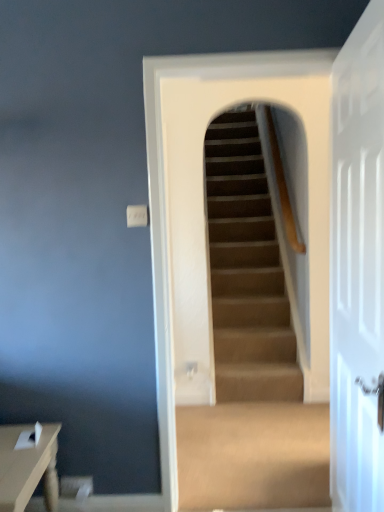
I want to click on matte brown table at lower left, so click(27, 467).

In order to face carpeted stairs at center, should I rotate leftwards or rightwards?

To face it directly, rotate right by 8.683 degrees.

You are a GUI agent. You are given a task and a screenshot of the screen. Output one action in this format:
    pyautogui.click(x=<x>, y=<y>)
    Task: Click on the matte brown table at lower left
    This screenshot has height=512, width=384.
    Given the screenshot: What is the action you would take?
    pyautogui.click(x=27, y=467)

Based on the photo, is carpeted stairs at center completely or partially inside white glossy door at right?

No, carpeted stairs at center is not a part of white glossy door at right.

From the image's perspective, is white glossy door at right located above or below carpeted stairs at center?

white glossy door at right is situated lower than carpeted stairs at center in the image.

Between white glossy door at right and carpeted stairs at center, which one has larger size?

With larger size is carpeted stairs at center.

Is white glossy door at right thinner than carpeted stairs at center?

Yes, white glossy door at right is thinner than carpeted stairs at center.

From a real-world perspective, is carpeted stairs at center above or below white glossy door at right?

From a real-world perspective, carpeted stairs at center is physically above white glossy door at right.

Is point (262, 244) less distant than point (333, 252)?

No, (262, 244) is further to viewer.

Is carpeted stairs at center looking in the opposite direction of white glossy door at right?

No, carpeted stairs at center's orientation is not away from white glossy door at right.

Is carpeted stairs at center touching white glossy door at right?

No.

Based on their sizes in the image, would you say carpeted stairs at center is bigger or smaller than matte brown table at lower left?

carpeted stairs at center is bigger than matte brown table at lower left.

Considering the positions of objects carpeted stairs at center and matte brown table at lower left in the image provided, who is more to the right, carpeted stairs at center or matte brown table at lower left?

From the viewer's perspective, carpeted stairs at center appears more on the right side.

Looking at their sizes, would you say carpeted stairs at center is wider or thinner than matte brown table at lower left?

In the image, carpeted stairs at center appears to be more narrow than matte brown table at lower left.

Which is closer, (224, 450) or (10, 432)?

The point (10, 432) is closer to the camera.

In the scene shown: From the image's perspective, is matte brown table at lower left above or below white glossy door at right?

Clearly, from the image's perspective, matte brown table at lower left is below white glossy door at right.

Are matte brown table at lower left and white glossy door at right located far from each other?

Indeed, matte brown table at lower left is not near white glossy door at right.

Can you confirm if matte brown table at lower left is bigger than white glossy door at right?

No, matte brown table at lower left is not bigger than white glossy door at right.

Does matte brown table at lower left appear on the right side of white glossy door at right?

In fact, matte brown table at lower left is to the left of white glossy door at right.

Can you confirm if matte brown table at lower left is wider than carpeted stairs at center?

Correct, the width of matte brown table at lower left exceeds that of carpeted stairs at center.

Is matte brown table at lower left facing away from carpeted stairs at center?

matte brown table at lower left does not have its back to carpeted stairs at center.

Which is in front, point (52, 470) or point (225, 155)?

Positioned in front is point (52, 470).

Considering the sizes of objects matte brown table at lower left and carpeted stairs at center in the image provided, who is smaller, matte brown table at lower left or carpeted stairs at center?

With smaller size is matte brown table at lower left.

Does white glossy door at right have a greater width compared to matte brown table at lower left?

In fact, white glossy door at right might be narrower than matte brown table at lower left.

Considering the positions of objects white glossy door at right and matte brown table at lower left in the image provided, who is behind, white glossy door at right or matte brown table at lower left?

matte brown table at lower left is behind.

Does white glossy door at right have a lesser height compared to matte brown table at lower left?

No, white glossy door at right is not shorter than matte brown table at lower left.

Can you confirm if white glossy door at right is bigger than matte brown table at lower left?

Indeed, white glossy door at right has a larger size compared to matte brown table at lower left.

There is a white glossy door at right. Where is `escalator above it (from a real-world perspective)`? This screenshot has width=384, height=512. escalator above it (from a real-world perspective) is located at coordinates (249, 352).

Image resolution: width=384 pixels, height=512 pixels. In order to click on door directly beneath the carpeted stairs at center (from a real-world perspective) in this screenshot , I will do `click(358, 268)`.

Based on the photo, from the image, which object appears to be nearer to carpeted stairs at center, matte brown table at lower left or white glossy door at right?

matte brown table at lower left.

Considering their positions, is carpeted stairs at center positioned further to matte brown table at lower left than white glossy door at right?

carpeted stairs at center is positioned further to the anchor matte brown table at lower left.

When comparing their distances from carpeted stairs at center, does white glossy door at right or matte brown table at lower left seem further?

white glossy door at right.

From the image, which object appears to be farther from white glossy door at right, matte brown table at lower left or carpeted stairs at center?

Among the two, carpeted stairs at center is located further to white glossy door at right.

In the scene shown: Considering their positions, is carpeted stairs at center positioned further to white glossy door at right than matte brown table at lower left?

carpeted stairs at center is positioned further to the anchor white glossy door at right.

Based on their spatial positions, is white glossy door at right or carpeted stairs at center closer to matte brown table at lower left?

Among the two, white glossy door at right is located nearer to matte brown table at lower left.

At what (x,y) coordinates should I click in order to perform the action: click on escalator located between matte brown table at lower left and white glossy door at right in the left-right direction. Please return your answer as a coordinate pair (x, y). This screenshot has width=384, height=512. Looking at the image, I should click on (249, 352).